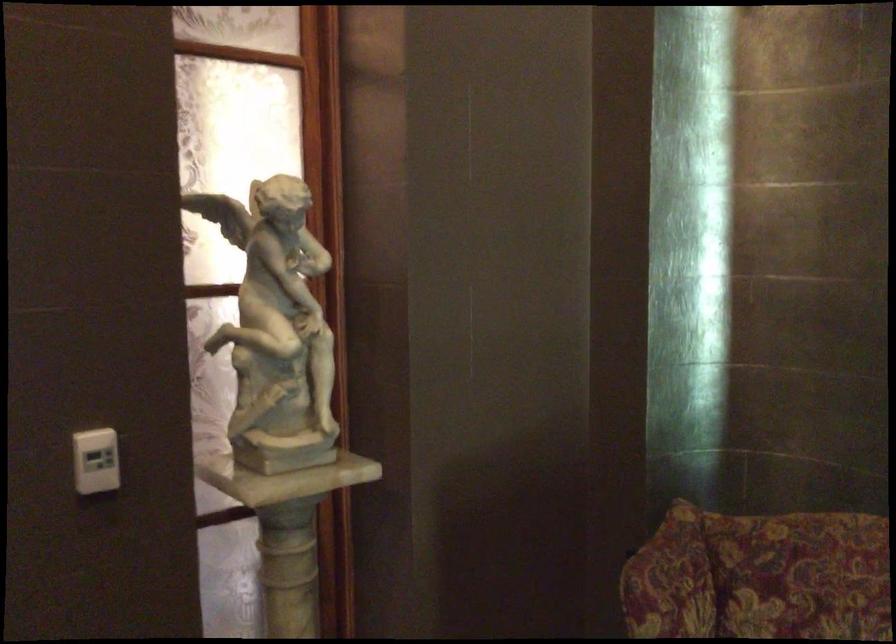
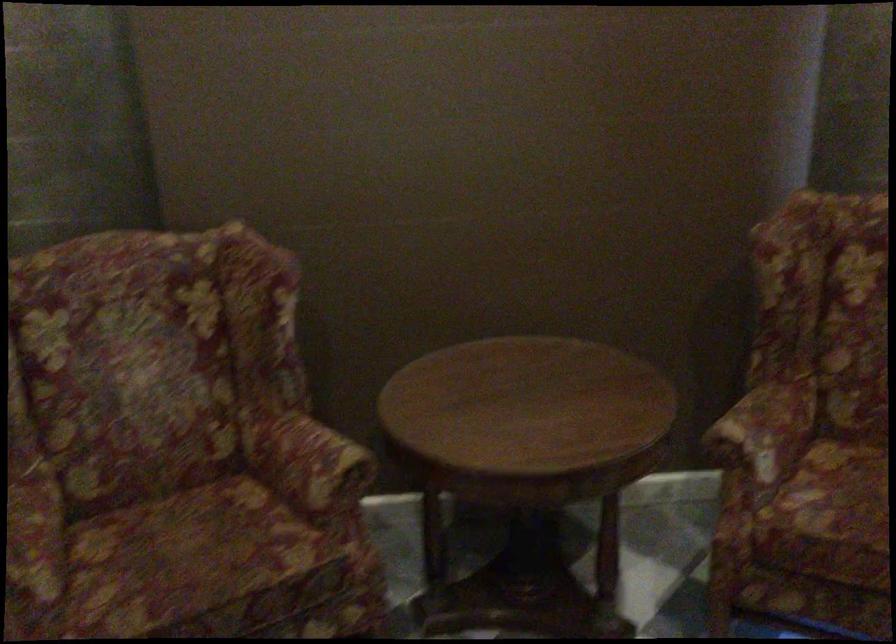
How did the camera likely rotate?

The rotation direction of the camera is right-down.